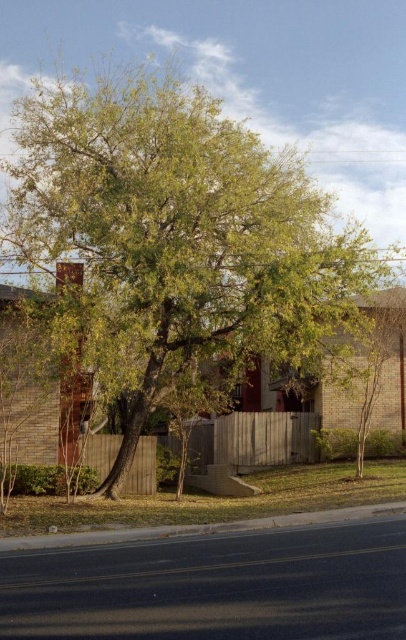
You are standing in the middle of the suburban scene and want to walk towards the wooden fence at center. Which direction should you move relative to the green leafy tree at center?

Since the green leafy tree at center is closer to the viewer than the wooden fence at center, you should move away from the green leafy tree at center to reach the wooden fence at center.

You are standing in the middle of the suburban scene and want to take a photo of both the green leafy tree at center and the wooden fence at center. Which object should you adjust your camera angle to focus on first if you want to capture both in the same frame?

The green leafy tree at center is located above the wooden fence at center, so you should adjust your camera angle to focus on the green leafy tree at center first to ensure both are in the frame.